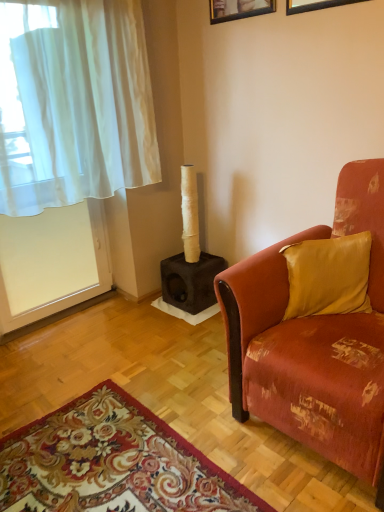
Question: Is floral carpet at lower left taller than silky gold pillow at right?

Choices:
 (A) yes
 (B) no

Answer: (B)

Question: Is floral carpet at lower left completely or partially outside of silky gold pillow at right?

Choices:
 (A) yes
 (B) no

Answer: (A)

Question: Can you confirm if floral carpet at lower left is thinner than silky gold pillow at right?

Choices:
 (A) yes
 (B) no

Answer: (B)

Question: Is floral carpet at lower left positioned behind silky gold pillow at right?

Choices:
 (A) no
 (B) yes

Answer: (A)

Question: Is silky gold pillow at right a part of floral carpet at lower left?

Choices:
 (A) yes
 (B) no

Answer: (B)

Question: Considering their positions, is white sheer curtain at left located in front of or behind black matte picture frame at upper center, which is the second picture frame from left to right?

Choices:
 (A) behind
 (B) front

Answer: (B)

Question: Is point (107, 119) positioned closer to the camera than point (299, 10)?

Choices:
 (A) closer
 (B) farther

Answer: (B)

Question: In terms of width, does white sheer curtain at left look wider or thinner when compared to black matte picture frame at upper center, the first picture frame when ordered from right to left?

Choices:
 (A) thin
 (B) wide

Answer: (B)

Question: From the image's perspective, is white sheer curtain at left positioned above or below black matte picture frame at upper center, placed as the second picture frame when sorted from back to front?

Choices:
 (A) below
 (B) above

Answer: (A)

Question: Considering the positions of wooden picture frame at upper center, which appears as the 1th picture frame when viewed from the left, and black matte picture frame at upper center, placed as the second picture frame when sorted from back to front, in the image, is wooden picture frame at upper center, which appears as the 1th picture frame when viewed from the left, wider or thinner than black matte picture frame at upper center, placed as the second picture frame when sorted from back to front,?

Choices:
 (A) thin
 (B) wide

Answer: (B)

Question: Is wooden picture frame at upper center, which is the 1th picture frame from back to front, spatially inside black matte picture frame at upper center, placed as the second picture frame when sorted from back to front, or outside of it?

Choices:
 (A) outside
 (B) inside

Answer: (A)

Question: From the image's perspective, is wooden picture frame at upper center, which is the 1th picture frame from back to front, above or below black matte picture frame at upper center, the first picture frame when ordered from right to left?

Choices:
 (A) below
 (B) above

Answer: (B)

Question: Considering the positions of point (225, 15) and point (289, 10), is point (225, 15) closer or farther from the camera than point (289, 10)?

Choices:
 (A) farther
 (B) closer

Answer: (A)

Question: Do you think wooden picture frame at upper center, the second picture frame when ordered from right to left, is within white sheer curtain at left, or outside of it?

Choices:
 (A) outside
 (B) inside

Answer: (A)

Question: Does point (269, 0) appear closer or farther from the camera than point (89, 54)?

Choices:
 (A) farther
 (B) closer

Answer: (A)